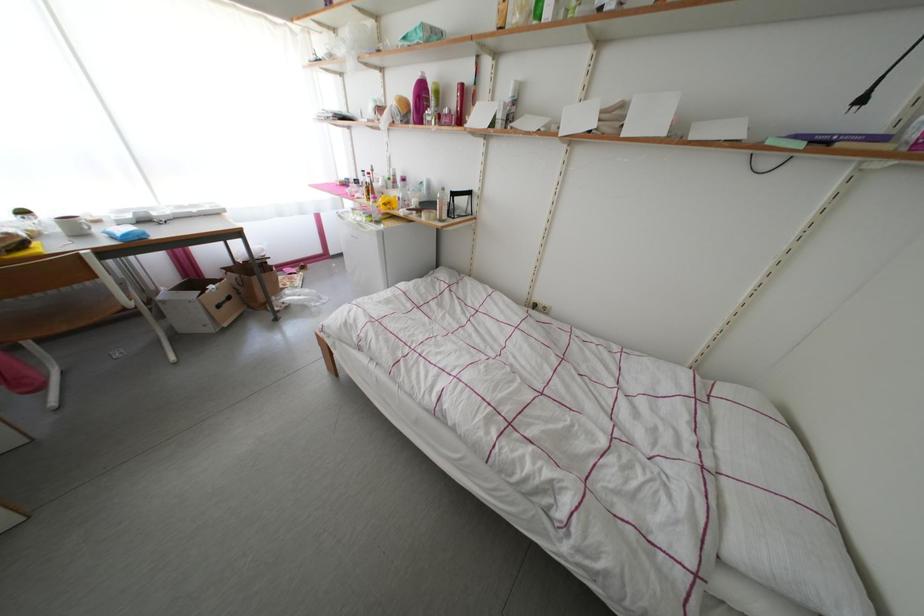
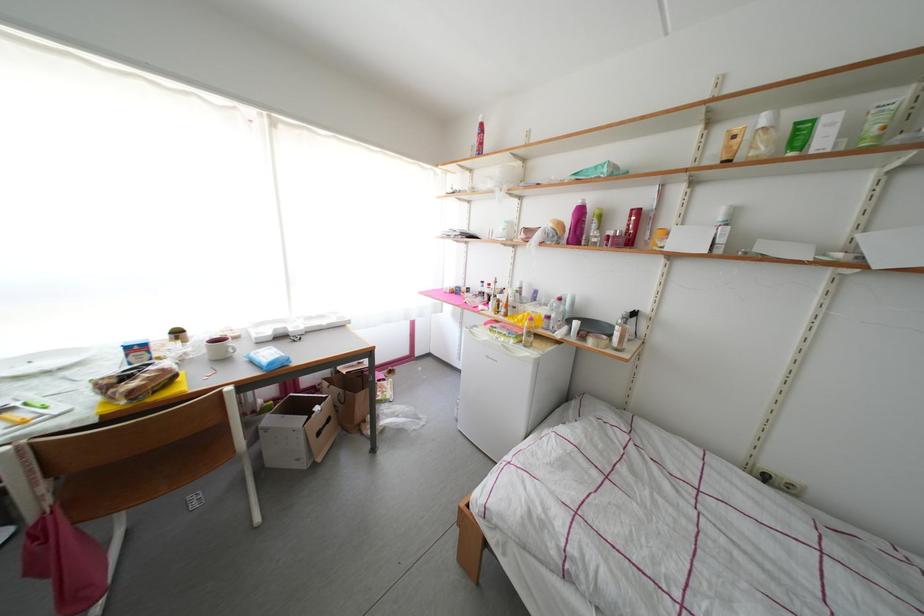
Question: Based on the continuous images, in which direction is the camera rotating? Reply with the corresponding letter.

Choices:
 (A) Left
 (B) Right
 (C) Up
 (D) Down

Answer: (C)